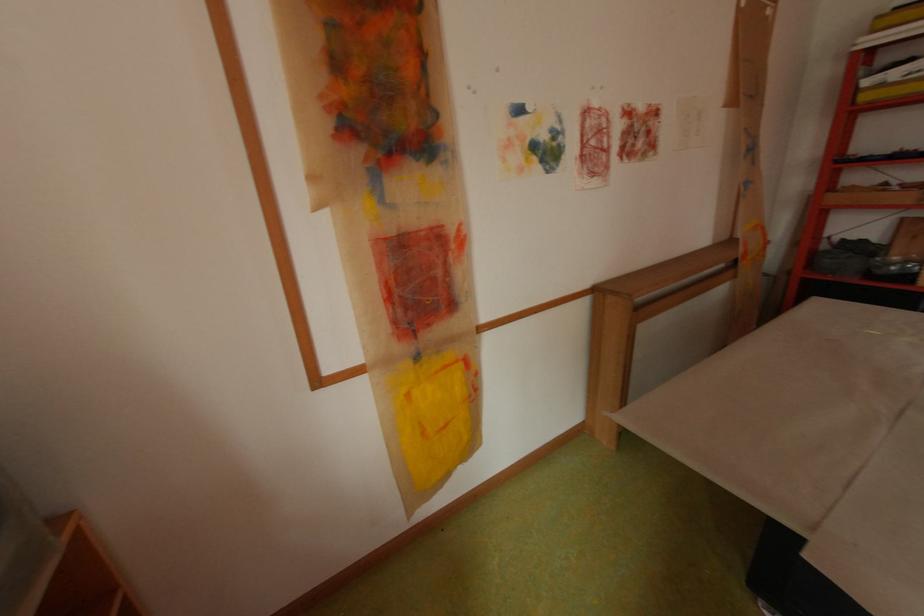
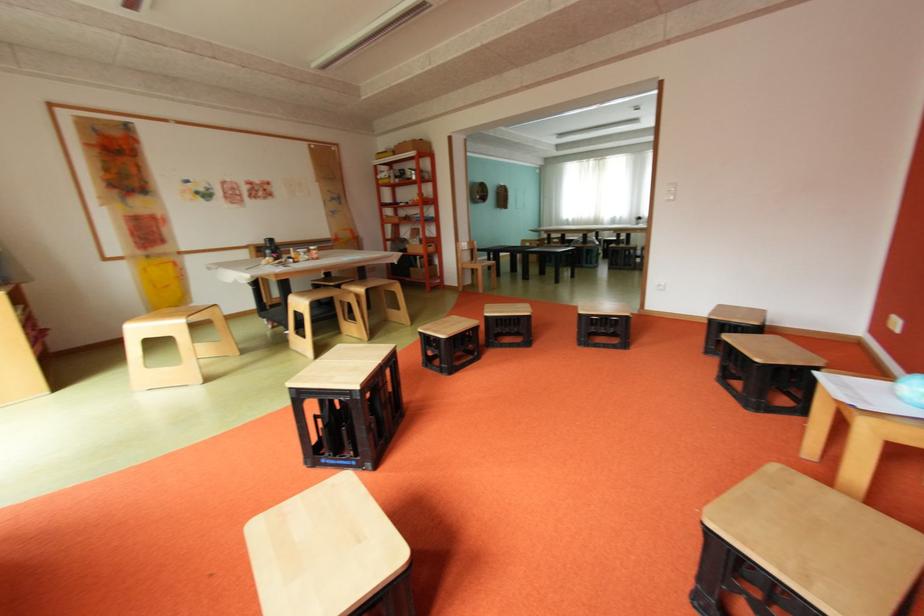
What movement of the cameraman would produce the second image?

The cameraman walked toward right, backward.